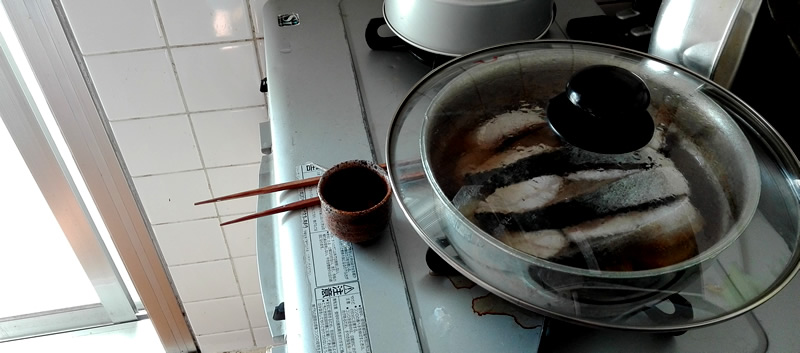
You are a GUI agent. You are given a task and a screenshot of the screen. Output one action in this format:
    pyautogui.click(x=<x>, y=<y>)
    Task: Click on the wall
    
    Given the screenshot: What is the action you would take?
    pyautogui.click(x=193, y=117)